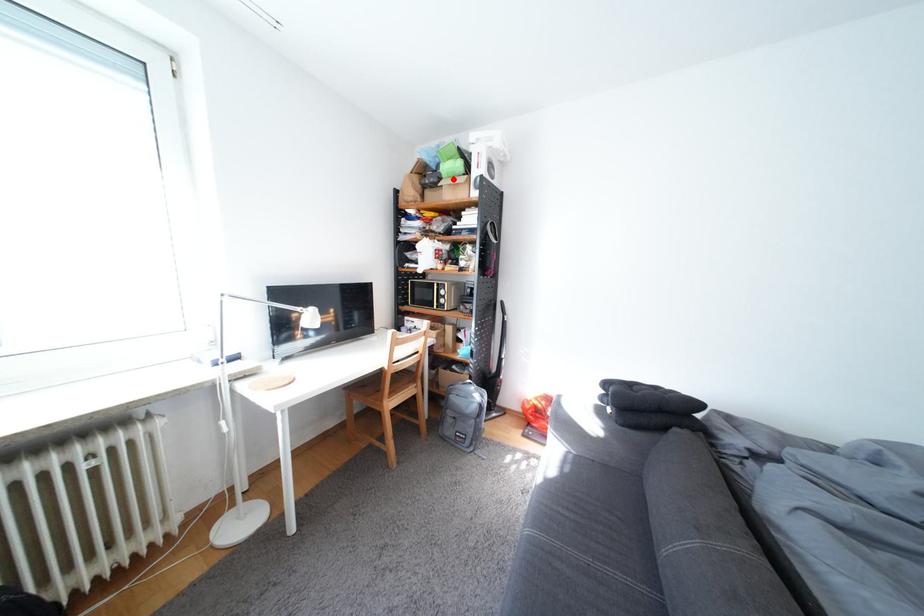
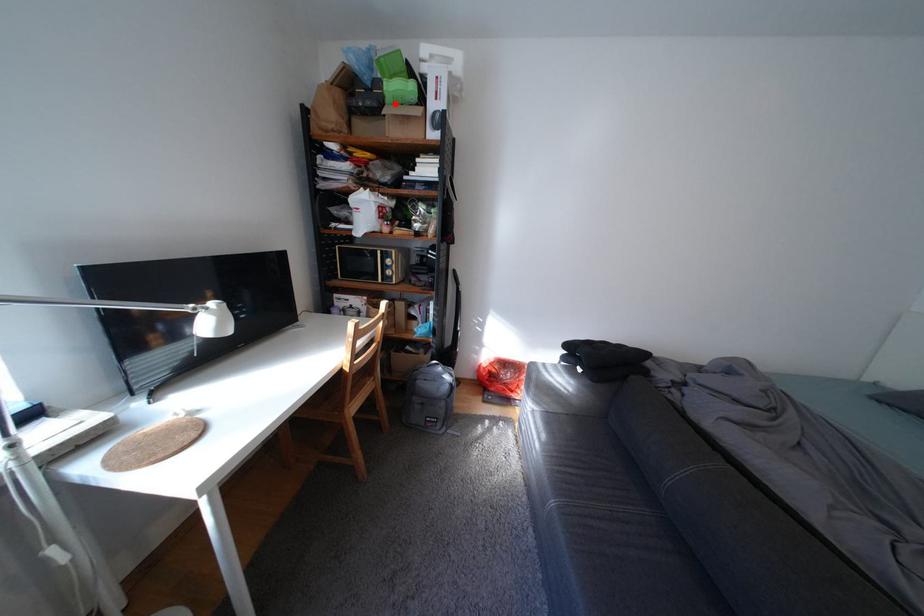
I am providing you with two images of the same scene from different viewpoints. A red point is marked on the first image and another point is marked on the second image. Do the highlighted points in image1 and image2 indicate the same real-world spot?

Yes